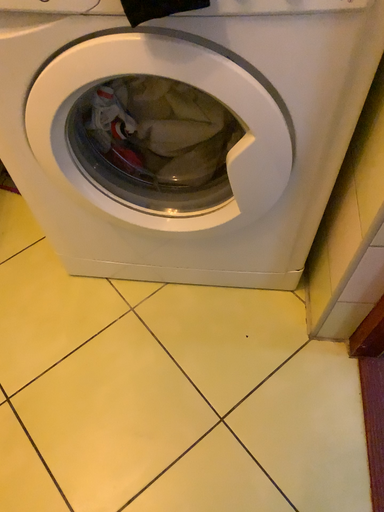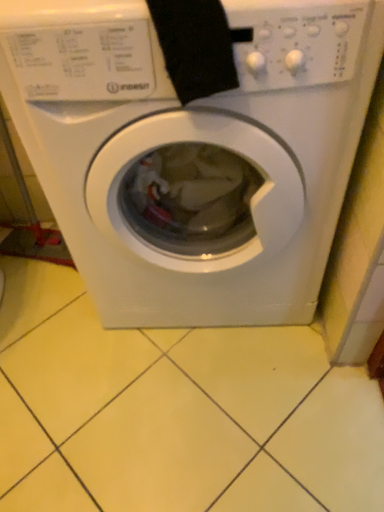
Question: How did the camera likely rotate when shooting the video?

Choices:
 (A) rotated downward
 (B) rotated upward

Answer: (B)